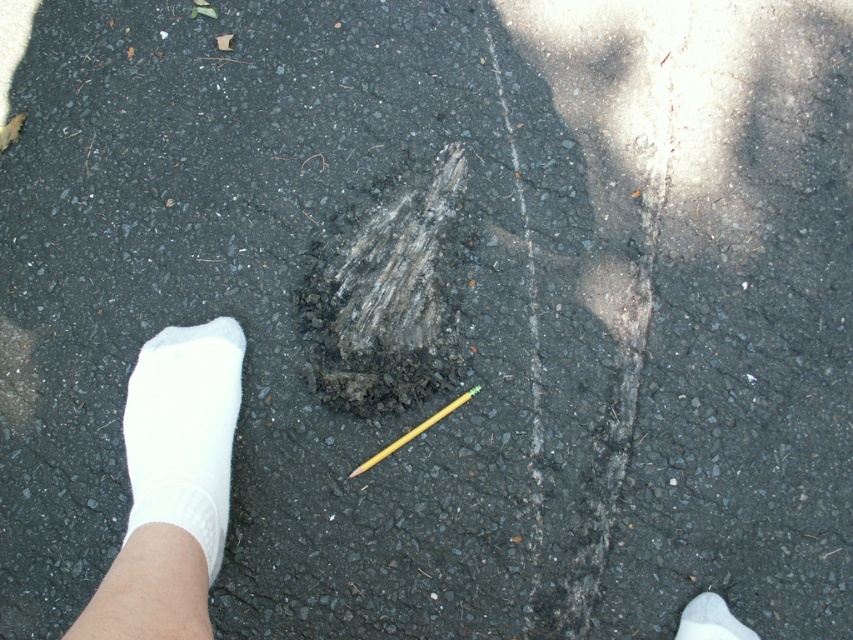
You are standing on the road and see the white sock at lower right and the yellow wood pencil at center. Which object is closer to your right side?

The white sock at lower right is to the right of the yellow wood pencil at center, so it is closer to your right side.

You are a pedestrian walking on the road and see the dark gray textured footprint at center and the white cotton sock at lower left. Which object is closer to your current position?

The white cotton sock at lower left is closer to your current position because it is located to the left of the dark gray textured footprint at center.